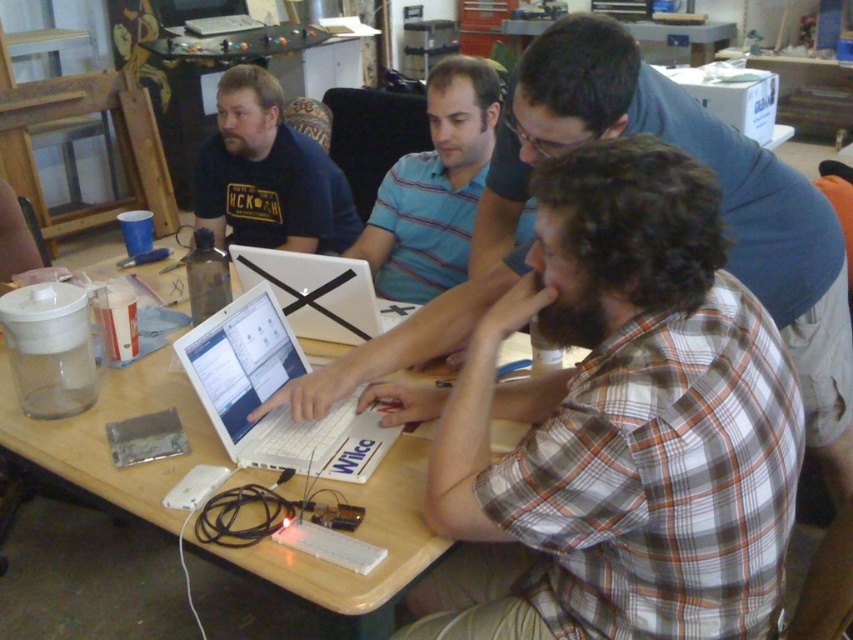
Question: Which is farther from the wooden table at center?

Choices:
 (A) white plastic laptop at center
 (B) white matte laptop at center
 (C) white checkered shirt at center

Answer: (C)

Question: Is white plastic laptop at center thinner than matte black shirt at upper left?

Choices:
 (A) no
 (B) yes

Answer: (B)

Question: Can you confirm if wooden table at center is positioned to the right of white matte laptop at center?

Choices:
 (A) yes
 (B) no

Answer: (B)

Question: Based on their relative distances, which object is nearer to the matte black shirt at upper left?

Choices:
 (A) wooden table at center
 (B) white matte laptop at center

Answer: (A)

Question: Among these objects, which one is farthest from the camera?

Choices:
 (A) white checkered shirt at center
 (B) wooden table at center

Answer: (B)

Question: Can you confirm if blue striped shirt at center is thinner than white matte laptop at center?

Choices:
 (A) yes
 (B) no

Answer: (B)